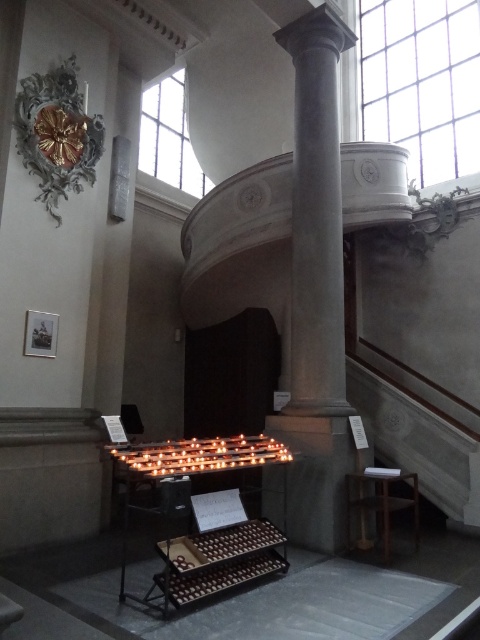
Question: Is smooth gray column at center below brown wooden stool at lower right?

Choices:
 (A) no
 (B) yes

Answer: (A)

Question: Which point is closer to the camera?

Choices:
 (A) (360, 497)
 (B) (300, 525)

Answer: (B)

Question: Can you confirm if smooth gray column at center is positioned above brown wooden stool at lower right?

Choices:
 (A) yes
 (B) no

Answer: (A)

Question: Does smooth gray column at center have a smaller size compared to brown wooden stool at lower right?

Choices:
 (A) yes
 (B) no

Answer: (B)